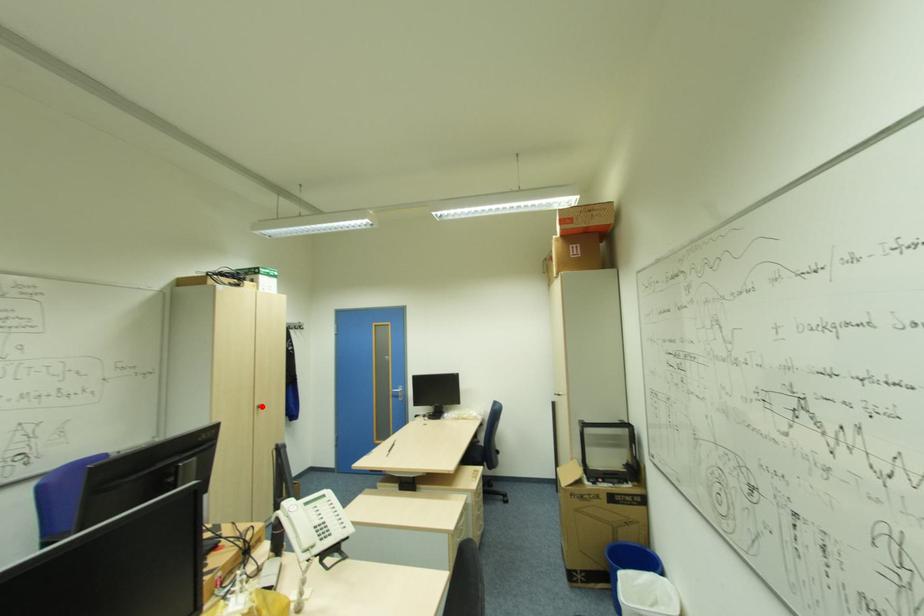
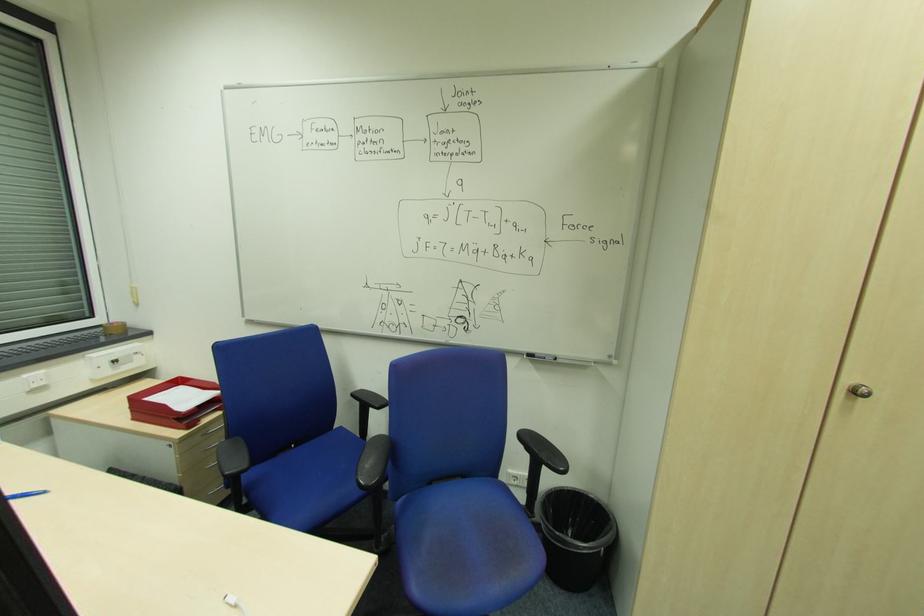
Question: I am providing you with two images of the same scene from different viewpoints. Given a red point in image1, look at the same physical point in image2. Is it:

Choices:
 (A) Closer to the viewpoint
 (B) Farther from the viewpoint

Answer: (A)